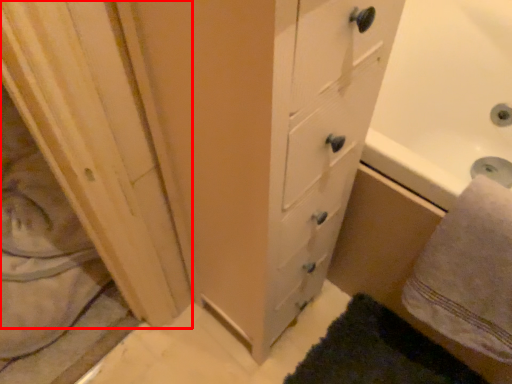
Question: From the image, what is the correct spatial relationship of screen door (annotated by the red box) in relation to bath towel?

Choices:
 (A) right
 (B) left

Answer: (B)